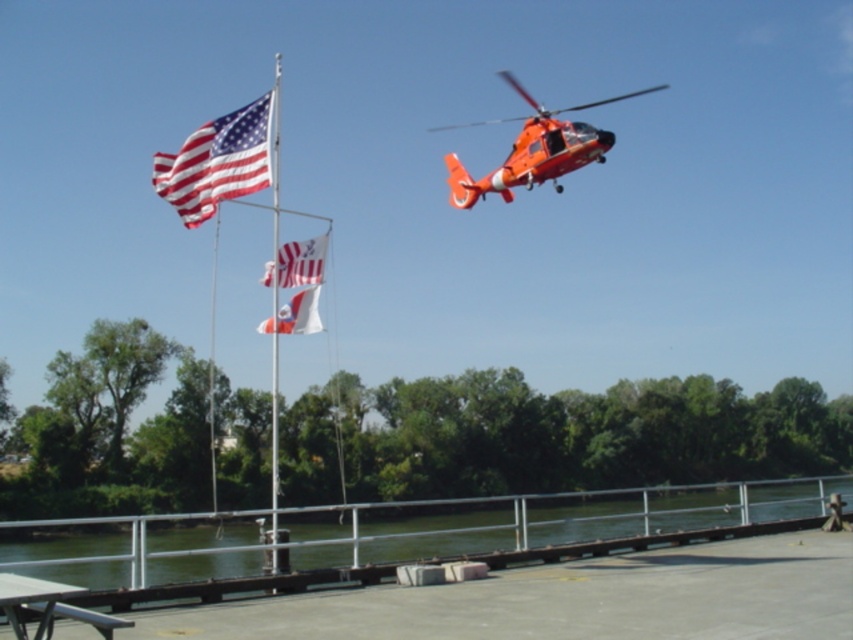
You are planning to have a picnic and need to set up your basket on the metallic silver picnic table at lower left. However, you also want to ensure the white fabric flag at upper center remains visible. Given their sizes, will the picnic basket fit on the table without blocking the flag?

The metallic silver picnic table at lower left has a larger size compared to the white fabric flag at upper center. Since the picnic table is larger, there should be enough space to place the picnic basket without obstructing the view of the flag.

You are a photographer trying to capture the american flag at upper left and the metallic flag pole at center in a single shot. Based on their sizes in the image, which object would appear smaller in your photo?

The american flag at upper left occupies less space than the metallic flag pole at center, so it would appear smaller in the photo.

You are a photographer trying to capture the american flag at upper left and the metallic flag pole at center in a single shot. Which object will appear narrower in the photo?

The american flag at upper left will appear narrower because it is thinner than the metallic flag pole at center.